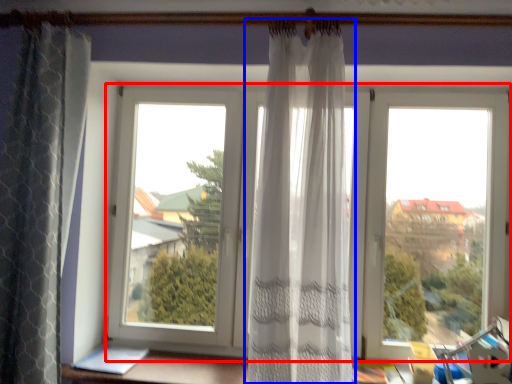
Question: Which object is further to the camera taking this photo, window (highlighted by a red box) or curtain (highlighted by a blue box)?

Choices:
 (A) window
 (B) curtain

Answer: (A)